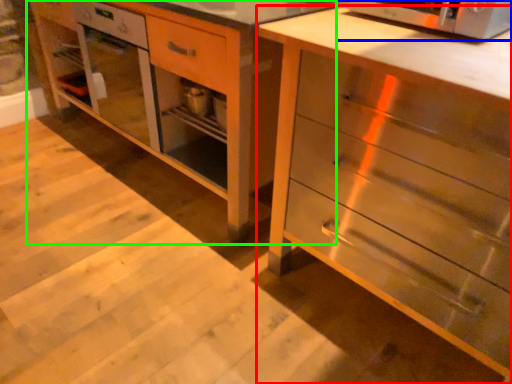
Question: Which object is the farthest from chest of drawers (highlighted by a red box)? Choose among these: microwave oven (highlighted by a blue box) or vanity (highlighted by a green box).

Choices:
 (A) microwave oven
 (B) vanity

Answer: (B)